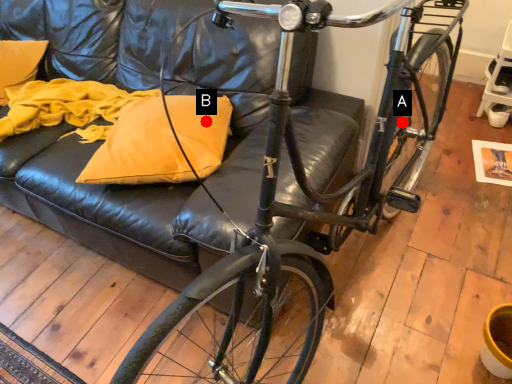
Question: Two points are circled on the image, labeled by A and B beside each circle. Which point appears closest to the camera in this image?

Choices:
 (A) A is closer
 (B) B is closer

Answer: (B)